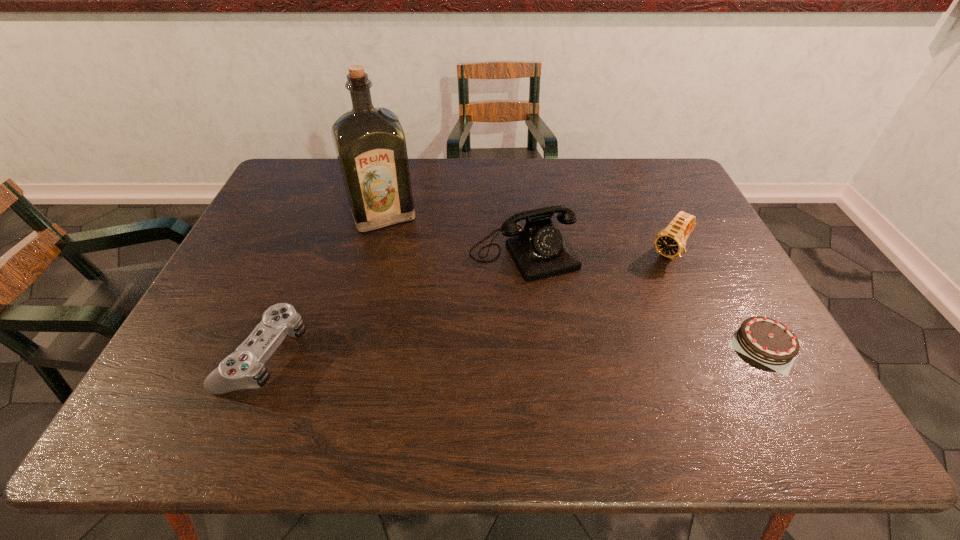
You are a GUI agent. You are given a task and a screenshot of the screen. Output one action in this format:
    pyautogui.click(x=<x>, y=<y>)
    Task: Click on the chocolate cake at the right edge
    This screenshot has height=540, width=960.
    Given the screenshot: What is the action you would take?
    767,341

At what (x,y) coordinates should I click in order to perform the action: click on watch positioned at the right edge. Please return your answer as a coordinate pair (x, y). Looking at the image, I should click on (670, 242).

The width and height of the screenshot is (960, 540). What are the coordinates of `object that is at the near left corner` in the screenshot? It's located at (244, 368).

The width and height of the screenshot is (960, 540). I want to click on object that is at the near right corner, so click(767, 341).

The width and height of the screenshot is (960, 540). In the image, there is a desktop. In order to click on vacant space at the far edge in this screenshot , I will do `click(598, 176)`.

This screenshot has height=540, width=960. In the image, there is a desktop. Find the location of `free space at the near edge`. free space at the near edge is located at coordinates (465, 367).

This screenshot has width=960, height=540. What are the coordinates of `free space at the left edge` in the screenshot? It's located at (281, 266).

Where is `vacant region at the right edge`? This screenshot has height=540, width=960. vacant region at the right edge is located at coordinates (734, 352).

Image resolution: width=960 pixels, height=540 pixels. What are the coordinates of `vacant space at the far left corner of the desktop` in the screenshot? It's located at (294, 166).

Find the location of a particular element. The height and width of the screenshot is (540, 960). vacant space at the far right corner is located at coordinates (653, 168).